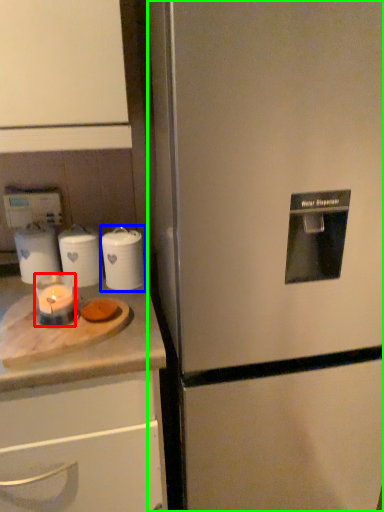
Question: Considering the real-world distances, which object is closest to candle holder (highlighted by a red box)? kitchen appliance (highlighted by a blue box) or refrigerator (highlighted by a green box).

Choices:
 (A) kitchen appliance
 (B) refrigerator

Answer: (A)